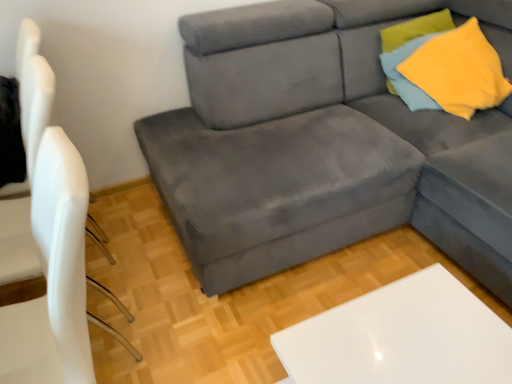
Identify the location of yellow soft fabric pillow at upper right. (415, 29).

You are a GUI agent. You are given a task and a screenshot of the screen. Output one action in this format:
    pyautogui.click(x=<x>, y=<y>)
    Task: Click on the white matte chair at left
    Image resolution: width=512 pixels, height=384 pixels.
    Given the screenshot: What is the action you would take?
    pyautogui.click(x=33, y=92)

Locate an element on the screen. yellow soft fabric pillow at upper right is located at coordinates point(415,29).

This screenshot has width=512, height=384. I want to click on throw pillow above the white glossy table at lower right (from a real-world perspective), so click(x=459, y=71).

Considering the relative positions of yellow soft fabric pillow at upper right and white glossy table at lower right in the image provided, is yellow soft fabric pillow at upper right to the left of white glossy table at lower right from the viewer's perspective?

In fact, yellow soft fabric pillow at upper right is to the right of white glossy table at lower right.

Are yellow soft fabric pillow at upper right and white glossy table at lower right beside each other?

yellow soft fabric pillow at upper right and white glossy table at lower right are not in contact.

What's the angular difference between yellow soft fabric pillow at upper right and velvet gray couch at center's facing directions?

The facing directions of yellow soft fabric pillow at upper right and velvet gray couch at center are 90 degrees apart.

I want to click on studio couch below the yellow soft fabric pillow at upper right (from a real-world perspective), so click(325, 143).

Are yellow soft fabric pillow at upper right and velvet gray couch at center located far from each other?

No, there isn't a large distance between yellow soft fabric pillow at upper right and velvet gray couch at center.

From a real-world perspective, is yellow soft fabric pillow at upper right located beneath velvet gray couch at center?

No, from a real-world perspective, yellow soft fabric pillow at upper right is not below velvet gray couch at center.

Does velvet gray couch at center appear on the right side of yellow soft fabric pillow at upper right?

In fact, velvet gray couch at center is to the left of yellow soft fabric pillow at upper right.

Between velvet gray couch at center and yellow soft fabric pillow at upper right, which one has larger size?

velvet gray couch at center is bigger.

In the image, there is a yellow soft fabric pillow at upper right. Where is `studio couch below it (from the image's perspective)`? studio couch below it (from the image's perspective) is located at coordinates (325, 143).

Which object is further away from the camera taking this photo, white matte chair at left or yellow soft fabric pillow at upper right?

yellow soft fabric pillow at upper right is further away from the camera.

Which is more to the right, white matte chair at left or yellow soft fabric pillow at upper right?

yellow soft fabric pillow at upper right is more to the right.

Is white matte chair at left outside of yellow soft fabric pillow at upper right?

Yes.

From a real-world perspective, which object rests below the other?

white matte chair at left is physically lower.

Considering their positions, is yellow soft fabric pillow at upper right located in front of or behind white matte chair at left?

yellow soft fabric pillow at upper right is behind white matte chair at left.

Is yellow soft fabric pillow at upper right wider or thinner than white matte chair at left?

In the image, yellow soft fabric pillow at upper right appears to be more narrow than white matte chair at left.

Identify the location of armchair that is below the yellow soft fabric pillow at upper right (from the image's perspective). (x=33, y=92).

How distant is yellow soft fabric pillow at upper right from white matte chair at left?

yellow soft fabric pillow at upper right is 5.33 feet away from white matte chair at left.

From the image's perspective, which one is positioned lower, white glossy table at lower right or yellow soft fabric pillow at upper right?

From the image's view, white glossy table at lower right is below.

Considering the positions of objects white glossy table at lower right and yellow soft fabric pillow at upper right in the image provided, who is behind, white glossy table at lower right or yellow soft fabric pillow at upper right?

yellow soft fabric pillow at upper right is further from the camera.

Considering the positions of point (416, 361) and point (403, 44), is point (416, 361) closer or farther from the camera than point (403, 44)?

Point (416, 361) is closer to the camera than point (403, 44).

Based on the photo, is white glossy table at lower right with yellow soft fabric pillow at upper right?

white glossy table at lower right and yellow soft fabric pillow at upper right are not in contact.

Is white glossy table at lower right behind yellow soft fabric pillow at upper right?

No, it is in front of yellow soft fabric pillow at upper right.

From the picture: Are white glossy table at lower right and yellow soft fabric pillow at upper right far apart?

That's right, there is a large distance between white glossy table at lower right and yellow soft fabric pillow at upper right.

Considering the relative sizes of white glossy table at lower right and yellow soft fabric pillow at upper right in the image provided, is white glossy table at lower right shorter than yellow soft fabric pillow at upper right?

Incorrect, the height of white glossy table at lower right does not fall short of that of yellow soft fabric pillow at upper right.

From the image's perspective, is white glossy table at lower right on yellow soft fabric pillow at upper right?

Actually, white glossy table at lower right appears below yellow soft fabric pillow at upper right in the image.

Where is `throw pillow above the white glossy table at lower right (from a real-world perspective)`? The image size is (512, 384). throw pillow above the white glossy table at lower right (from a real-world perspective) is located at coordinates (459, 71).

The height and width of the screenshot is (384, 512). What are the coordinates of `studio couch that appears below the yellow soft fabric pillow at upper right (from the image's perspective)` in the screenshot? It's located at (325, 143).

Estimate the real-world distances between objects in this image. Which object is closer to white matte chair at left, velvet gray couch at center or white glossy table at lower right?

Based on the image, white glossy table at lower right appears to be nearer to white matte chair at left.

Based on their spatial positions, is white glossy table at lower right or white matte chair at left closer to yellow soft fabric pillow at upper right?

white glossy table at lower right lies closer to yellow soft fabric pillow at upper right than the other object.

Looking at the image, which one is located further to yellow soft fabric pillow at upper right, white matte chair at left or white glossy table at lower right?

white matte chair at left lies further to yellow soft fabric pillow at upper right than the other object.

Estimate the real-world distances between objects in this image. Which object is further from yellow soft fabric pillow at upper right, white matte chair at left or yellow soft fabric pillow at upper right?

white matte chair at left is further to yellow soft fabric pillow at upper right.

From the picture: Estimate the real-world distances between objects in this image. Which object is closer to white glossy table at lower right, white matte chair at left or velvet gray couch at center?

The object closer to white glossy table at lower right is velvet gray couch at center.

From the image, which object appears to be nearer to white glossy table at lower right, white matte chair at left or yellow soft fabric pillow at upper right?

The object closer to white glossy table at lower right is white matte chair at left.

In the scene shown: From the image, which object appears to be farther from velvet gray couch at center, yellow soft fabric pillow at upper right or yellow soft fabric pillow at upper right?

yellow soft fabric pillow at upper right.

Estimate the real-world distances between objects in this image. Which object is further from white glossy table at lower right, yellow soft fabric pillow at upper right or white matte chair at left?

yellow soft fabric pillow at upper right lies further to white glossy table at lower right than the other object.

Where is `studio couch located between white matte chair at left and yellow soft fabric pillow at upper right in the left-right direction`? studio couch located between white matte chair at left and yellow soft fabric pillow at upper right in the left-right direction is located at coordinates (325, 143).

The width and height of the screenshot is (512, 384). In order to click on table located between velvet gray couch at center and yellow soft fabric pillow at upper right in the depth direction in this screenshot , I will do `click(401, 337)`.

You are a GUI agent. You are given a task and a screenshot of the screen. Output one action in this format:
    pyautogui.click(x=<x>, y=<y>)
    Task: Click on the table between white matte chair at left and yellow soft fabric pillow at upper right from left to right
    
    Given the screenshot: What is the action you would take?
    pyautogui.click(x=401, y=337)

At what (x,y) coordinates should I click in order to perform the action: click on table between white matte chair at left and yellow soft fabric pillow at upper right in the horizontal direction. Please return your answer as a coordinate pair (x, y). Image resolution: width=512 pixels, height=384 pixels. Looking at the image, I should click on (401, 337).